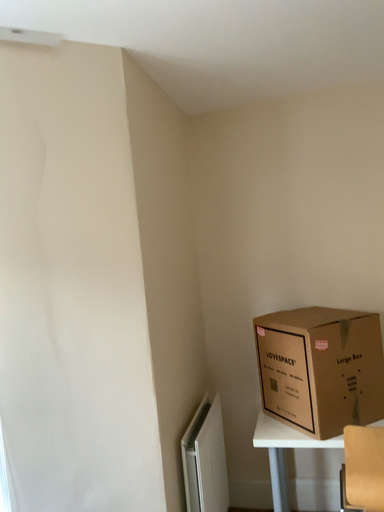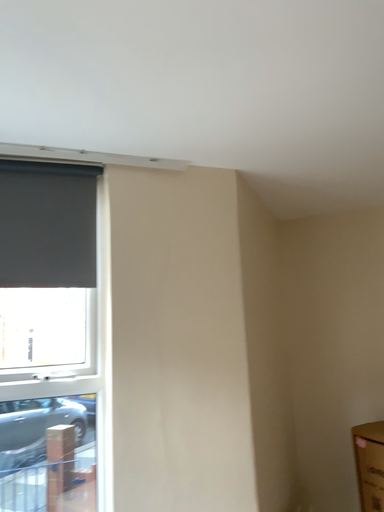
Question: How did the camera likely rotate when shooting the video?

Choices:
 (A) rotated left
 (B) rotated right

Answer: (A)